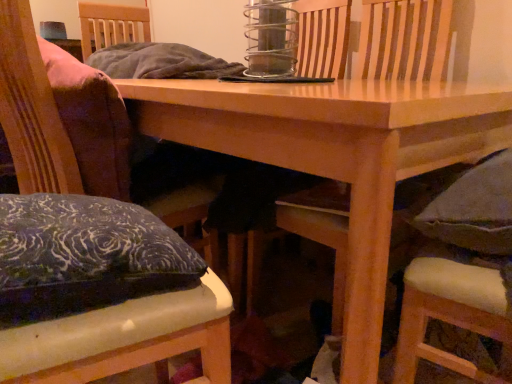
Question: Is velvet cushioned armchair at center with velvet cushion at left, the 2th chair positioned from the right?

Choices:
 (A) no
 (B) yes

Answer: (A)

Question: Is velvet cushioned armchair at center further to the viewer compared to velvet cushion at left, which is counted as the second chair, starting from the left?

Choices:
 (A) no
 (B) yes

Answer: (B)

Question: From a real-world perspective, is velvet cushioned armchair at center over velvet cushion at left, the 2th chair positioned from the right?

Choices:
 (A) yes
 (B) no

Answer: (A)

Question: Is velvet cushioned armchair at center located outside velvet cushion at left, which is counted as the second chair, starting from the left?

Choices:
 (A) no
 (B) yes

Answer: (B)

Question: Is velvet cushioned armchair at center smaller than velvet cushion at left, which is counted as the second chair, starting from the left?

Choices:
 (A) no
 (B) yes

Answer: (A)

Question: Is wooden table at center situated inside velvet cushioned armchair at center or outside?

Choices:
 (A) outside
 (B) inside

Answer: (A)

Question: From a real-world perspective, is wooden table at center positioned above or below velvet cushioned armchair at center?

Choices:
 (A) below
 (B) above

Answer: (A)

Question: In terms of width, does wooden table at center look wider or thinner when compared to velvet cushioned armchair at center?

Choices:
 (A) wide
 (B) thin

Answer: (A)

Question: Considering the positions of point (177, 114) and point (393, 163), is point (177, 114) closer or farther from the camera than point (393, 163)?

Choices:
 (A) farther
 (B) closer

Answer: (A)

Question: Considering the positions of point [374, 33] and point [147, 342], is point [374, 33] closer or farther from the camera than point [147, 342]?

Choices:
 (A) closer
 (B) farther

Answer: (B)

Question: In terms of height, does velvet cushioned armchair at center look taller or shorter compared to velvet cushion at left, which appears as the third chair when viewed from the right?

Choices:
 (A) tall
 (B) short

Answer: (A)

Question: Do you think velvet cushioned armchair at center is within velvet cushion at left, which appears as the third chair when viewed from the right, or outside of it?

Choices:
 (A) outside
 (B) inside

Answer: (A)

Question: Considering the positions of velvet cushioned armchair at center and velvet cushion at left, which appears as the 1th chair when viewed from the left, in the image, is velvet cushioned armchair at center bigger or smaller than velvet cushion at left, which appears as the 1th chair when viewed from the left,?

Choices:
 (A) big
 (B) small

Answer: (A)

Question: Is point (16, 44) closer or farther from the camera than point (479, 248)?

Choices:
 (A) farther
 (B) closer

Answer: (A)

Question: From a real-world perspective, relative to dark gray cushioned chair at lower right, positioned as the 3th chair in left-to-right order, is velvet cushion at left, which appears as the 1th chair when viewed from the left, vertically above or below?

Choices:
 (A) above
 (B) below

Answer: (B)